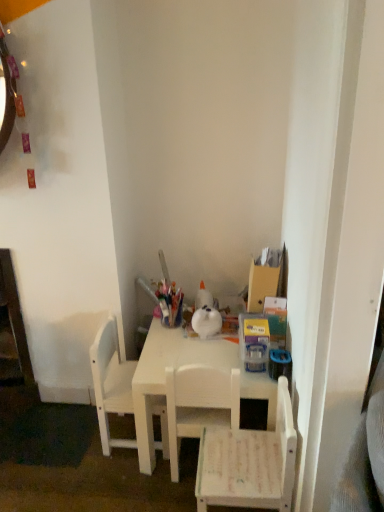
The width and height of the screenshot is (384, 512). Identify the location of free space to the left of white matte chair at center, which ranks as the 2th chair in right-to-left order. (129, 483).